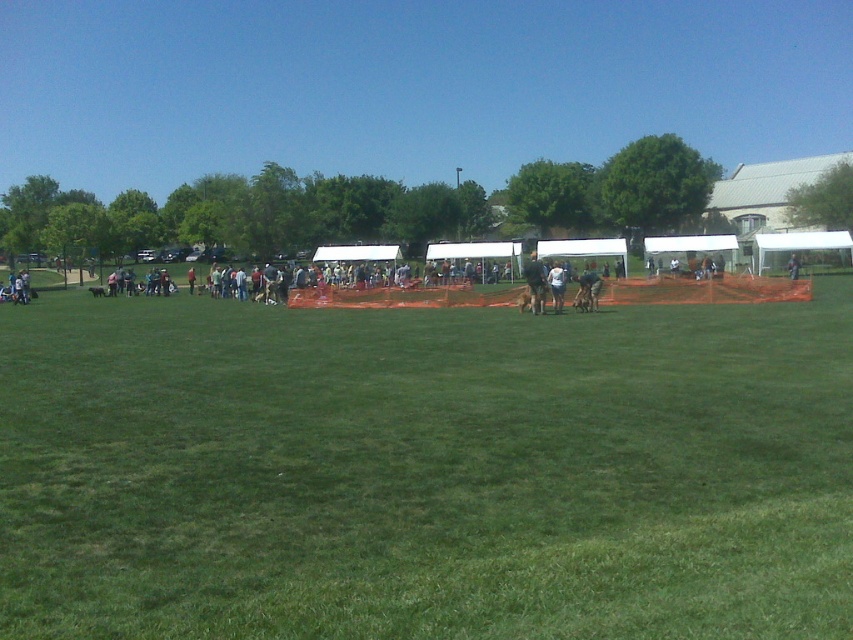
You are standing in the grassy field and see both the white cotton shirt at center and the matte black dog at center. Which object is closer to you?

The white cotton shirt at center is closer to you because it is positioned under the matte black dog at center, meaning the dog is between you and the shirt.

You are standing at the origin point of the image coordinate system. Where is the green grassy field at center located?

The green grassy field at center is located at point (425, 470).

You are standing at the origin point of the image coordinate system. Where exactly is the green grassy field at center located?

The green grassy field at center is located at point (425, 470).